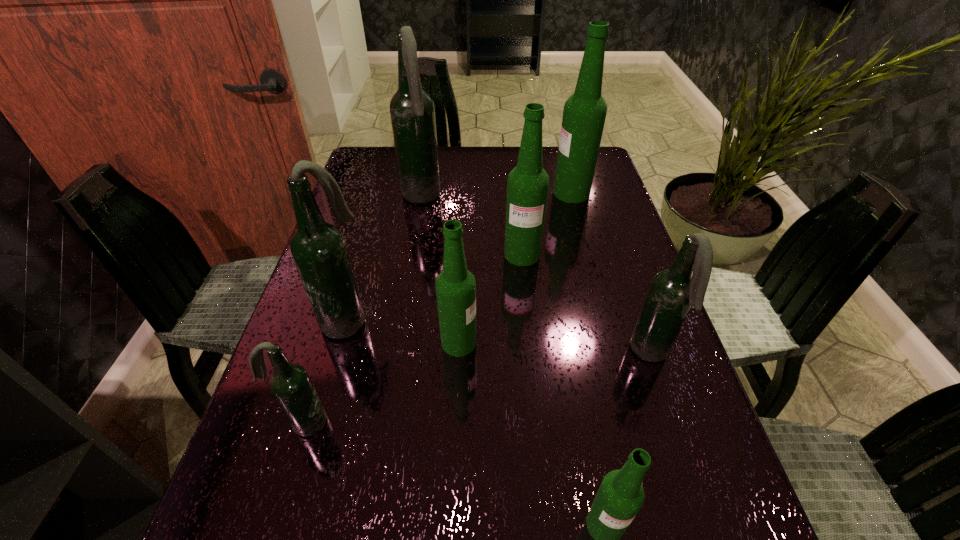
The height and width of the screenshot is (540, 960). What are the coordinates of `dark beer bottle object that ranks as the closest to the nearest dark beer bottle` in the screenshot? It's located at (x=318, y=248).

I want to click on dark beer bottle that is the third nearest to the sixth nearest beer bottle, so click(318, 248).

Find the location of `vacant position in the image that satisfies the following two spatial constraints: 1. on the label of the fourth object from right to left; 2. on the right side of the second smallest dark beer bottle`. vacant position in the image that satisfies the following two spatial constraints: 1. on the label of the fourth object from right to left; 2. on the right side of the second smallest dark beer bottle is located at coordinates (533, 354).

This screenshot has height=540, width=960. I want to click on free location that satisfies the following two spatial constraints: 1. on the label of the rightmost green beer bottle; 2. on the label of the fifth beer bottle from left to right, so point(588,254).

Where is `free spot that satisfies the following two spatial constraints: 1. on the label of the rightmost dark beer bottle; 2. on the right side of the leftmost green beer bottle`? Image resolution: width=960 pixels, height=540 pixels. free spot that satisfies the following two spatial constraints: 1. on the label of the rightmost dark beer bottle; 2. on the right side of the leftmost green beer bottle is located at coordinates (458, 354).